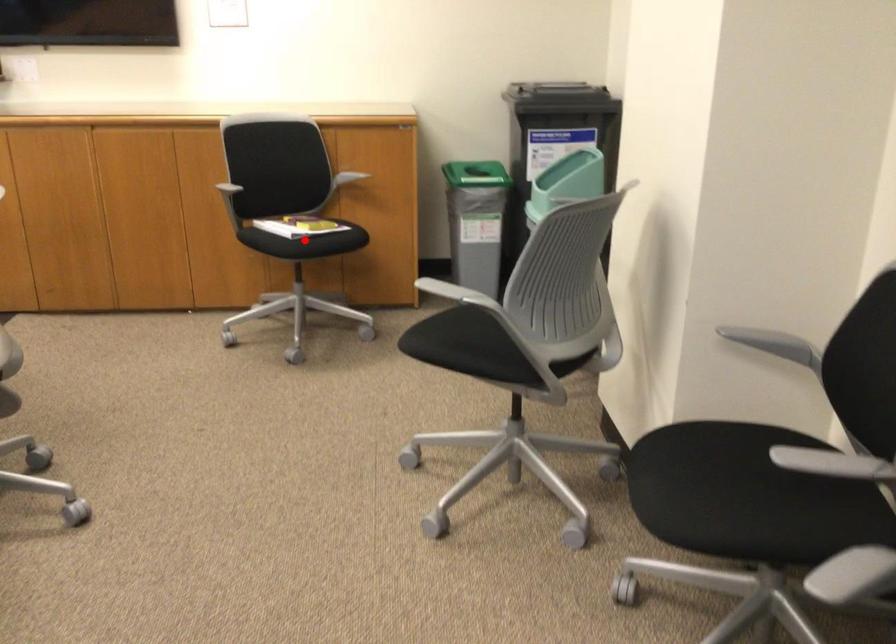
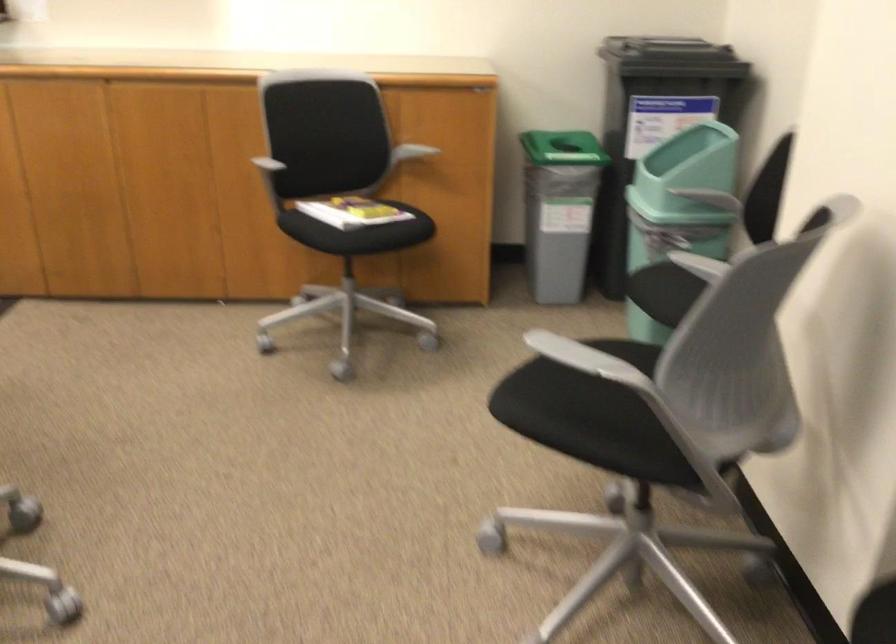
Question: I am providing you with two images of the same scene from different viewpoints. In image1, a red point is highlighted. Considering the same 3D point in image2, which of the following is correct?

Choices:
 (A) It is closer
 (B) It is farther

Answer: (A)